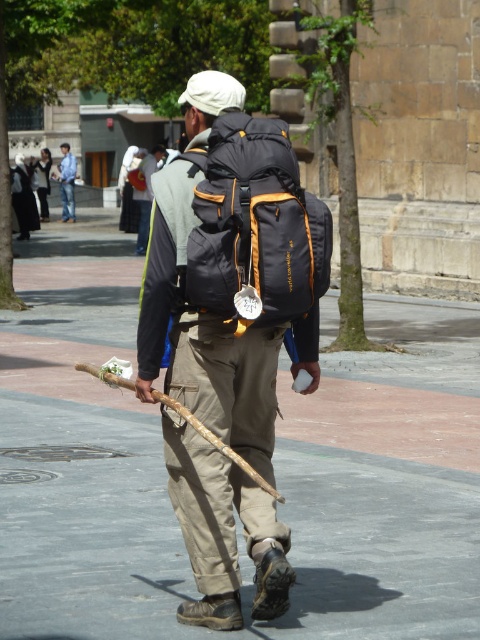
Question: Which object is positioned farthest from the gray concrete pavement at center?

Choices:
 (A) matte gray backpack at center
 (B) black fabric backpack at center
 (C) blue denim jeans at center

Answer: (C)

Question: Based on their relative distances, which object is farther from the khaki pants at center?

Choices:
 (A) black fabric backpack at center
 (B) matte gray backpack at center
 (C) blue denim jeans at center

Answer: (C)

Question: Which point is farther to the camera?

Choices:
 (A) (x=377, y=509)
 (B) (x=68, y=148)
 (C) (x=277, y=268)
 (D) (x=146, y=188)

Answer: (B)

Question: Can you confirm if khaki pants at center is wider than black fabric backpack at center?

Choices:
 (A) yes
 (B) no

Answer: (A)

Question: Does khaki pants at center have a smaller size compared to black fabric backpack at center?

Choices:
 (A) no
 (B) yes

Answer: (A)

Question: Is matte gray backpack at center closer to the viewer compared to blue denim jeans at center?

Choices:
 (A) no
 (B) yes

Answer: (B)